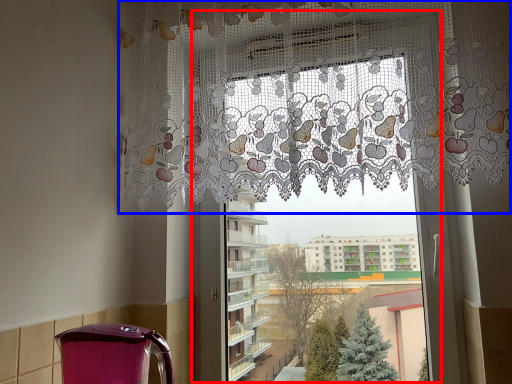
Question: Which of the following is the closest to the observer, window frame (highlighted by a red box) or curtain (highlighted by a blue box)?

Choices:
 (A) window frame
 (B) curtain

Answer: (B)